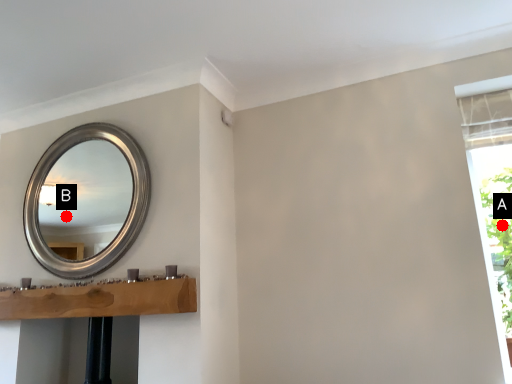
Question: Two points are circled on the image, labeled by A and B beside each circle. Among these points, which one is nearest to the camera?

Choices:
 (A) A is closer
 (B) B is closer

Answer: (A)